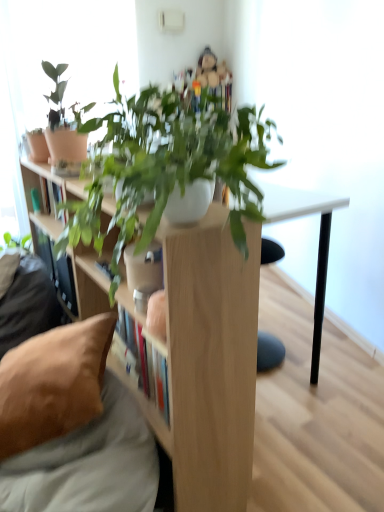
Describe the element at coordinates (37, 146) in the screenshot. I see `matte white flowerpot at upper left` at that location.

The height and width of the screenshot is (512, 384). What do you see at coordinates (53, 383) in the screenshot?
I see `brown fabric pillow at lower left` at bounding box center [53, 383].

The width and height of the screenshot is (384, 512). Identify the location of light wood shelf at center, placed as the 2th shelf when sorted from left to right. (209, 362).

What do you see at coordinates (63, 129) in the screenshot?
I see `matte clay pot at upper left` at bounding box center [63, 129].

Measure the distance between wooden bookshelf at left, which appears as the 1th shelf when viewed from the left, and camera.

wooden bookshelf at left, which appears as the 1th shelf when viewed from the left, is 5.27 feet away from camera.

Locate an element on the screen. The image size is (384, 512). matte white flowerpot at upper left is located at coordinates pos(37,146).

Does point (40, 498) lie in front of point (42, 140)?

Yes, point (40, 498) is closer to viewer.

Can you confirm if brown fabric couch at lower left is bigger than matte white flowerpot at upper left?

Yes.

Is brown fabric couch at lower left taller than matte white flowerpot at upper left?

Yes, brown fabric couch at lower left is taller than matte white flowerpot at upper left.

Which object is closer to the camera taking this photo, brown fabric couch at lower left or matte white flowerpot at upper left?

brown fabric couch at lower left is closer to the camera.

From their relative heights in the image, would you say light wood shelf at center, positioned as the first shelf in right-to-left order, is taller or shorter than brown fabric couch at lower left?

light wood shelf at center, positioned as the first shelf in right-to-left order, is taller than brown fabric couch at lower left.

Between light wood shelf at center, positioned as the first shelf in right-to-left order, and brown fabric couch at lower left, which one has smaller size?

brown fabric couch at lower left is smaller.

From the image's perspective, between light wood shelf at center, positioned as the first shelf in right-to-left order, and brown fabric couch at lower left, which one is located above?

From the image's view, light wood shelf at center, positioned as the first shelf in right-to-left order, is above.

Consider the image. From a real-world perspective, which is physically below, brown fabric pillow at lower left or wooden bookshelf at left, which appears as the 1th shelf when viewed from the left?

brown fabric pillow at lower left, from a real-world perspective.

Measure the distance between brown fabric pillow at lower left and wooden bookshelf at left, the second shelf viewed from the right.

brown fabric pillow at lower left is 74.58 centimeters from wooden bookshelf at left, the second shelf viewed from the right.

Which object is further away from the camera taking this photo, brown fabric pillow at lower left or wooden bookshelf at left, which appears as the 1th shelf when viewed from the left?

wooden bookshelf at left, which appears as the 1th shelf when viewed from the left, is more distant.

Does brown fabric pillow at lower left have a greater height compared to wooden bookshelf at left, the second shelf viewed from the right?

No.

Can you confirm if matte clay pot at upper left is wider than matte white flowerpot at upper left?

Correct, the width of matte clay pot at upper left exceeds that of matte white flowerpot at upper left.

Locate an element on the screen. flowerpot that appears behind the matte clay pot at upper left is located at coordinates (37, 146).

How far apart are matte clay pot at upper left and matte white flowerpot at upper left?

The distance of matte clay pot at upper left from matte white flowerpot at upper left is 5.87 inches.

Is matte white flowerpot at upper left a part of matte clay pot at upper left?

No, matte white flowerpot at upper left is not surrounded by matte clay pot at upper left.

Considering the relative positions of brown fabric couch at lower left and light wood shelf at center, positioned as the first shelf in right-to-left order, in the image provided, is brown fabric couch at lower left in front of light wood shelf at center, positioned as the first shelf in right-to-left order,?

Yes.

From a real-world perspective, is brown fabric couch at lower left physically located above or below light wood shelf at center, positioned as the first shelf in right-to-left order?

brown fabric couch at lower left is situated lower than light wood shelf at center, positioned as the first shelf in right-to-left order, in the real world.

At what (x,y) coordinates should I click in order to perform the action: click on the 1st shelf behind the brown fabric couch at lower left. Please return your answer as a coordinate pair (x, y). This screenshot has height=512, width=384. Looking at the image, I should click on (209, 362).

Considering the relative sizes of light wood shelf at center, placed as the 2th shelf when sorted from left to right, and wooden bookshelf at left, which appears as the 1th shelf when viewed from the left, in the image provided, is light wood shelf at center, placed as the 2th shelf when sorted from left to right, shorter than wooden bookshelf at left, which appears as the 1th shelf when viewed from the left,?

No, light wood shelf at center, placed as the 2th shelf when sorted from left to right, is not shorter than wooden bookshelf at left, which appears as the 1th shelf when viewed from the left.

Which object is further away from the camera, light wood shelf at center, positioned as the first shelf in right-to-left order, or wooden bookshelf at left, the second shelf viewed from the right?

Positioned behind is wooden bookshelf at left, the second shelf viewed from the right.

From a real-world perspective, is light wood shelf at center, positioned as the first shelf in right-to-left order, beneath wooden bookshelf at left, which appears as the 1th shelf when viewed from the left?

Correct, in the physical world, light wood shelf at center, positioned as the first shelf in right-to-left order, is lower than wooden bookshelf at left, which appears as the 1th shelf when viewed from the left.

Considering the positions of point (194, 234) and point (48, 213), is point (194, 234) closer or farther from the camera than point (48, 213)?

Point (194, 234).

Does matte white flowerpot at upper left lie behind wooden bookshelf at left, which appears as the 1th shelf when viewed from the left?

No, the depth of matte white flowerpot at upper left is less than that of wooden bookshelf at left, which appears as the 1th shelf when viewed from the left.

From the image's perspective, is matte white flowerpot at upper left beneath wooden bookshelf at left, which appears as the 1th shelf when viewed from the left?

No.

This screenshot has height=512, width=384. Find the location of `flowerpot in front of the wooden bookshelf at left, the second shelf viewed from the right`. flowerpot in front of the wooden bookshelf at left, the second shelf viewed from the right is located at coordinates (37, 146).

Identify the location of flowerpot on the left of brown fabric couch at lower left. Image resolution: width=384 pixels, height=512 pixels. (37, 146).

From a real-world perspective, count 1st shelfs upward from the brown fabric couch at lower left and point to it. Please provide its 2D coordinates.

[(209, 362)]

Considering their positions, is matte clay pot at upper left positioned closer to light wood shelf at center, placed as the 2th shelf when sorted from left to right, than matte white flowerpot at upper left?

matte clay pot at upper left is positioned closer to the anchor light wood shelf at center, placed as the 2th shelf when sorted from left to right.

Based on their spatial positions, is brown fabric pillow at lower left or light wood shelf at center, placed as the 2th shelf when sorted from left to right, closer to brown fabric couch at lower left?

Among the two, brown fabric pillow at lower left is located nearer to brown fabric couch at lower left.

Estimate the real-world distances between objects in this image. Which object is closer to matte white flowerpot at upper left, brown fabric pillow at lower left or brown fabric couch at lower left?

Based on the image, brown fabric pillow at lower left appears to be nearer to matte white flowerpot at upper left.

Looking at the image, which one is located further to light wood shelf at center, positioned as the first shelf in right-to-left order, brown fabric couch at lower left or matte white flowerpot at upper left?

matte white flowerpot at upper left is positioned further to the anchor light wood shelf at center, positioned as the first shelf in right-to-left order.

In the scene shown: When comparing their distances from wooden bookshelf at left, the second shelf viewed from the right, does matte clay pot at upper left or brown fabric pillow at lower left seem closer?

The object closer to wooden bookshelf at left, the second shelf viewed from the right, is matte clay pot at upper left.

When comparing their distances from matte white flowerpot at upper left, does matte clay pot at upper left or brown fabric couch at lower left seem further?

brown fabric couch at lower left is positioned further to the anchor matte white flowerpot at upper left.

From the image, which object appears to be farther from brown fabric couch at lower left, matte white flowerpot at upper left or matte clay pot at upper left?

Among the two, matte white flowerpot at upper left is located further to brown fabric couch at lower left.

Looking at the image, which one is located further to matte white flowerpot at upper left, light wood shelf at center, placed as the 2th shelf when sorted from left to right, or matte clay pot at upper left?

light wood shelf at center, placed as the 2th shelf when sorted from left to right, is further to matte white flowerpot at upper left.

This screenshot has width=384, height=512. In order to click on houseplant located between light wood shelf at center, placed as the 2th shelf when sorted from left to right, and matte white flowerpot at upper left in the depth direction in this screenshot , I will do `click(63, 129)`.

Where is `pillow between light wood shelf at center, placed as the 2th shelf when sorted from left to right, and wooden bookshelf at left, which appears as the 1th shelf when viewed from the left, in the front-back direction`? The image size is (384, 512). pillow between light wood shelf at center, placed as the 2th shelf when sorted from left to right, and wooden bookshelf at left, which appears as the 1th shelf when viewed from the left, in the front-back direction is located at coordinates (53, 383).

At what (x,y) coordinates should I click in order to perform the action: click on pillow between matte white flowerpot at upper left and brown fabric couch at lower left vertically. Please return your answer as a coordinate pair (x, y). Looking at the image, I should click on (53, 383).

Locate an element on the screen. flowerpot between matte clay pot at upper left and brown fabric pillow at lower left vertically is located at coordinates (37, 146).